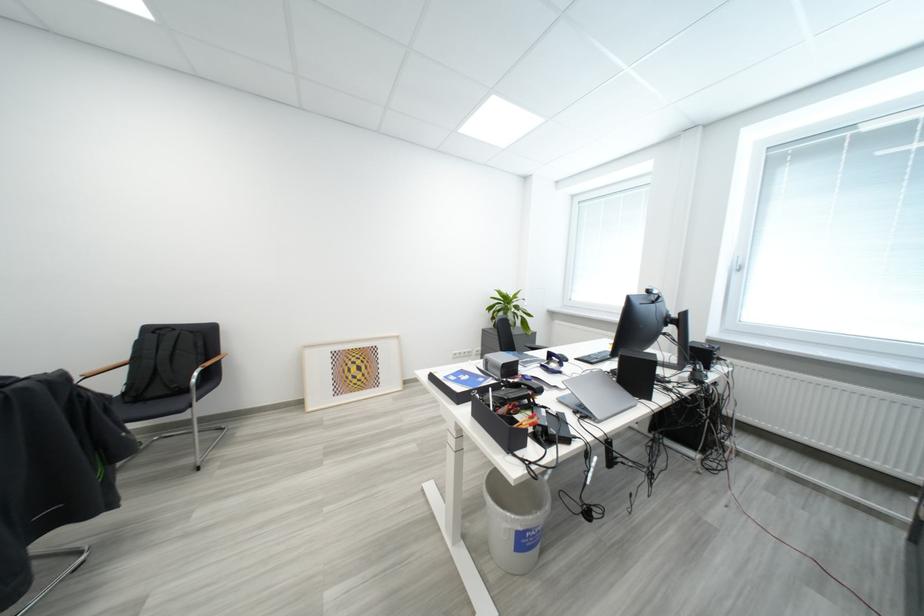
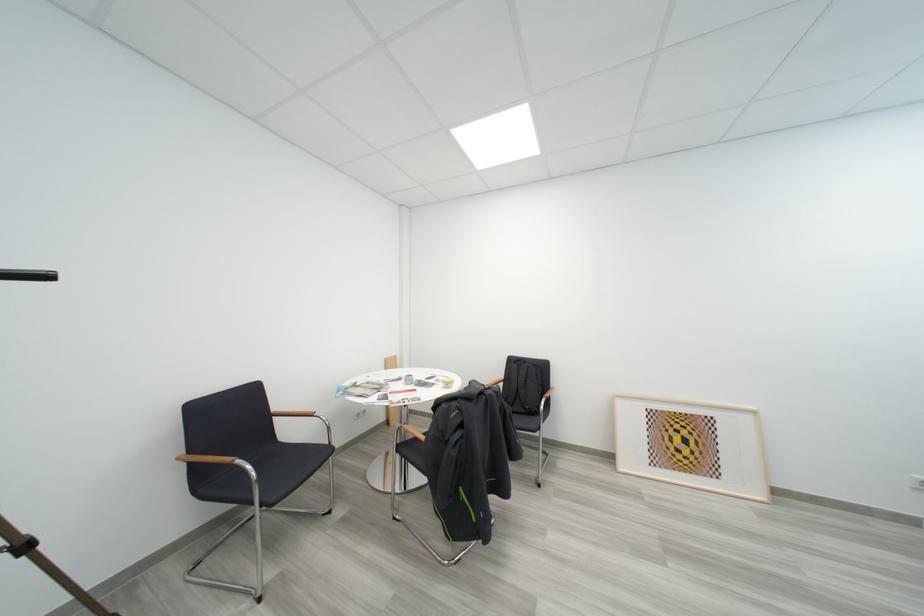
The point at (x=368, y=365) is marked in the first image. Where is the corresponding point in the second image?

(693, 435)